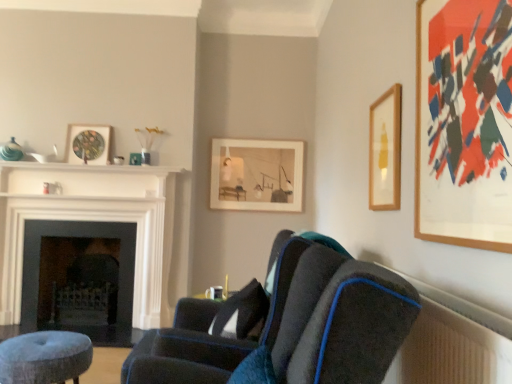
This screenshot has height=384, width=512. In order to click on free point above matte wooden picture frame at center, which is counted as the second picture frame, starting from the left (from a real-world perspective) in this screenshot , I will do `click(256, 140)`.